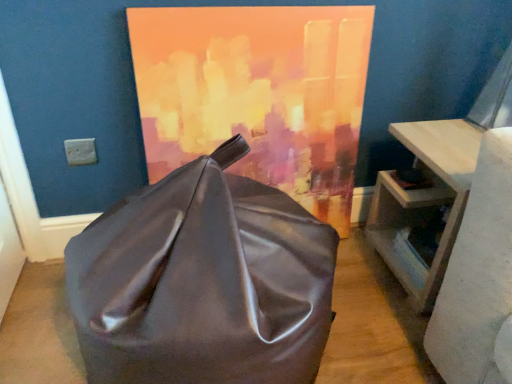
What is the approximate width of shiny brown bean bag at center?

It is 25.30 inches.

This screenshot has height=384, width=512. What do you see at coordinates (423, 202) in the screenshot? I see `light wood table at right` at bounding box center [423, 202].

Identify the location of shiny brown bean bag at center. (203, 282).

Does point (286, 68) come in front of point (115, 375)?

No, (286, 68) is further to viewer.

Considering the relative positions of matte acrylic painting at center and shiny brown bean bag at center in the image provided, is matte acrylic painting at center to the left of shiny brown bean bag at center from the viewer's perspective?

In fact, matte acrylic painting at center is to the right of shiny brown bean bag at center.

From a real-world perspective, who is located higher, matte acrylic painting at center or shiny brown bean bag at center?

From a 3D spatial view, matte acrylic painting at center is above.

Consider the image. Does matte acrylic painting at center have a lesser height compared to shiny brown bean bag at center?

In fact, matte acrylic painting at center may be taller than shiny brown bean bag at center.

Is matte acrylic painting at center thinner than light wood table at right?

Indeed, matte acrylic painting at center has a lesser width compared to light wood table at right.

Locate an element on the screen. Image resolution: width=512 pixels, height=384 pixels. oil painting that appears above the light wood table at right (from the image's perspective) is located at coordinates (257, 93).

Is matte acrylic painting at center closer to camera compared to light wood table at right?

Yes, it is in front of light wood table at right.

Is matte acrylic painting at center to the right of light wood table at right from the viewer's perspective?

In fact, matte acrylic painting at center is to the left of light wood table at right.

Is shiny brown bean bag at center bigger or smaller than light wood table at right?

shiny brown bean bag at center is bigger than light wood table at right.

The height and width of the screenshot is (384, 512). I want to click on furniture above the light wood table at right (from a real-world perspective), so click(203, 282).

From a real-world perspective, does shiny brown bean bag at center sit lower than light wood table at right?

No.

Considering the relative sizes of light wood table at right and shiny brown bean bag at center in the image provided, is light wood table at right thinner than shiny brown bean bag at center?

Indeed, light wood table at right has a lesser width compared to shiny brown bean bag at center.

From a real-world perspective, is light wood table at right positioned over shiny brown bean bag at center based on gravity?

No, from a real-world perspective, light wood table at right is not over shiny brown bean bag at center

Does light wood table at right have a larger size compared to shiny brown bean bag at center?

No, light wood table at right is not bigger than shiny brown bean bag at center.

Considering the positions of objects light wood table at right and shiny brown bean bag at center in the image provided, who is more to the left, light wood table at right or shiny brown bean bag at center?

Positioned to the left is shiny brown bean bag at center.

Is matte acrylic painting at center located within light wood table at right?

No, matte acrylic painting at center is not inside light wood table at right.

Between light wood table at right and matte acrylic painting at center, which one has smaller width?

With smaller width is matte acrylic painting at center.

Which is more to the right, light wood table at right or matte acrylic painting at center?

light wood table at right.

From the picture: Considering the sizes of shiny brown bean bag at center and matte acrylic painting at center in the image, is shiny brown bean bag at center wider or thinner than matte acrylic painting at center?

In the image, shiny brown bean bag at center appears to be wider than matte acrylic painting at center.

Where is `furniture below the matte acrylic painting at center (from a real-world perspective)`? Image resolution: width=512 pixels, height=384 pixels. furniture below the matte acrylic painting at center (from a real-world perspective) is located at coordinates (203, 282).

Considering the positions of objects shiny brown bean bag at center and matte acrylic painting at center in the image provided, who is more to the left, shiny brown bean bag at center or matte acrylic painting at center?

Positioned to the left is shiny brown bean bag at center.

Is matte acrylic painting at center located within shiny brown bean bag at center?

No, shiny brown bean bag at center does not contain matte acrylic painting at center.

Image resolution: width=512 pixels, height=384 pixels. Identify the location of furniture below the matte acrylic painting at center (from a real-world perspective). (203, 282).

Find the location of a particular element. oil painting lying on the left of light wood table at right is located at coordinates 257,93.

Based on their spatial positions, is light wood table at right or shiny brown bean bag at center closer to matte acrylic painting at center?

Based on the image, light wood table at right appears to be nearer to matte acrylic painting at center.

Estimate the real-world distances between objects in this image. Which object is closer to shiny brown bean bag at center, light wood table at right or matte acrylic painting at center?

Based on the image, matte acrylic painting at center appears to be nearer to shiny brown bean bag at center.

Looking at the image, which one is located further to light wood table at right, matte acrylic painting at center or shiny brown bean bag at center?

shiny brown bean bag at center.

From the image, which object appears to be nearer to matte acrylic painting at center, shiny brown bean bag at center or light wood table at right?

The object closer to matte acrylic painting at center is light wood table at right.

Estimate the real-world distances between objects in this image. Which object is further from light wood table at right, shiny brown bean bag at center or matte acrylic painting at center?

shiny brown bean bag at center.

Considering their positions, is matte acrylic painting at center positioned further to shiny brown bean bag at center than light wood table at right?

Among the two, light wood table at right is located further to shiny brown bean bag at center.

This screenshot has width=512, height=384. I want to click on oil painting located between shiny brown bean bag at center and light wood table at right in the left-right direction, so click(257, 93).